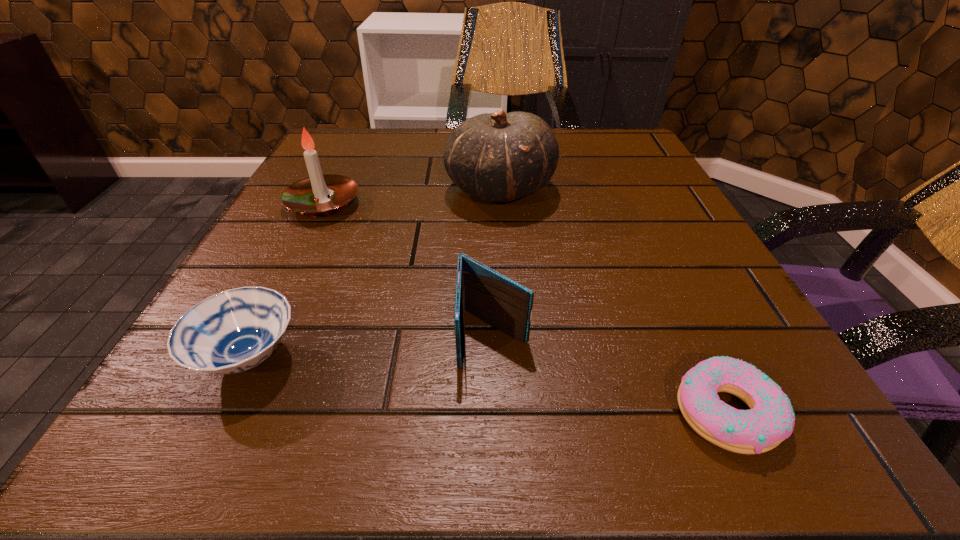
The width and height of the screenshot is (960, 540). In order to click on vacant space located on the back of the rightmost object in this screenshot , I will do point(624,196).

Where is `object at the far edge`? The height and width of the screenshot is (540, 960). object at the far edge is located at coordinates (497, 157).

Identify the location of soup bowl at the near edge. (233, 331).

The width and height of the screenshot is (960, 540). Find the location of `doughnut positioned at the near edge`. doughnut positioned at the near edge is located at coordinates (770, 420).

Where is `candle located at the left edge`? The height and width of the screenshot is (540, 960). candle located at the left edge is located at coordinates (309, 196).

The image size is (960, 540). Find the location of `soup bowl that is at the left edge`. soup bowl that is at the left edge is located at coordinates (233, 331).

In order to click on object located at the right edge in this screenshot , I will do `click(770, 420)`.

You are a GUI agent. You are given a task and a screenshot of the screen. Output one action in this format:
    pyautogui.click(x=<x>, y=<y>)
    Task: Click on the object that is at the near left corner
    The width and height of the screenshot is (960, 540).
    Given the screenshot: What is the action you would take?
    233,331

Find the location of a particular element. object that is positioned at the near right corner is located at coordinates (770, 420).

Where is `vacant space at the far edge`? vacant space at the far edge is located at coordinates (404, 178).